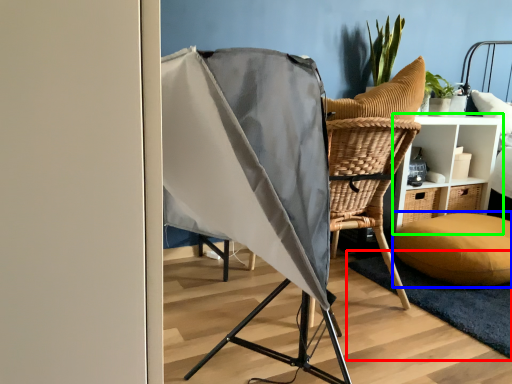
Question: Which object is positioned closest to mat (highlighted by a red box)? Select from pillow (highlighted by a blue box) and furniture (highlighted by a green box).

Choices:
 (A) pillow
 (B) furniture

Answer: (A)